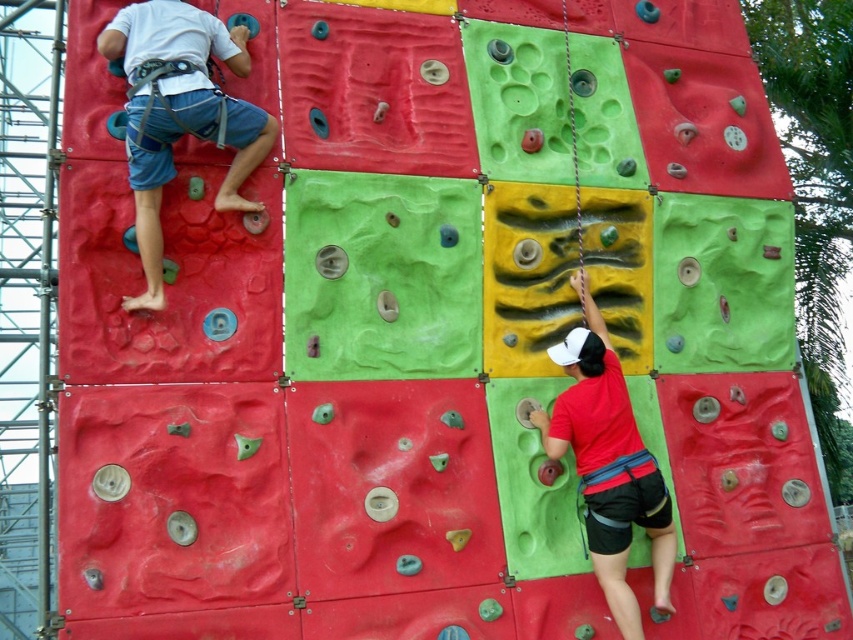
Question: Considering the relative positions of matte blue shorts at left and matte red shirt at lower right in the image provided, where is matte blue shorts at left located with respect to matte red shirt at lower right?

Choices:
 (A) left
 (B) right

Answer: (A)

Question: In this image, where is matte blue shorts at left located relative to matte red shirt at lower right?

Choices:
 (A) left
 (B) right

Answer: (A)

Question: Which of the following is the closest to the observer?

Choices:
 (A) (560, 435)
 (B) (154, 4)

Answer: (B)

Question: Is matte blue shorts at left below matte red shirt at lower right?

Choices:
 (A) yes
 (B) no

Answer: (B)